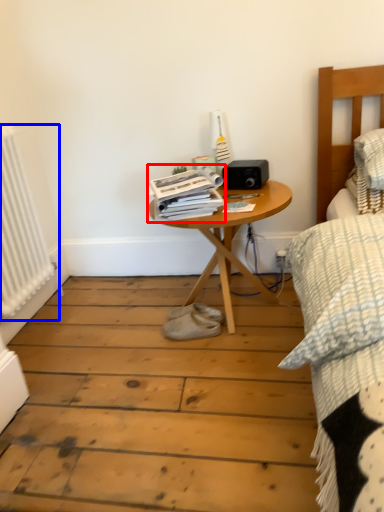
Question: Among these objects, which one is nearest to the camera, magazine (highlighted by a red box) or radiator (highlighted by a blue box)?

Choices:
 (A) magazine
 (B) radiator

Answer: (B)